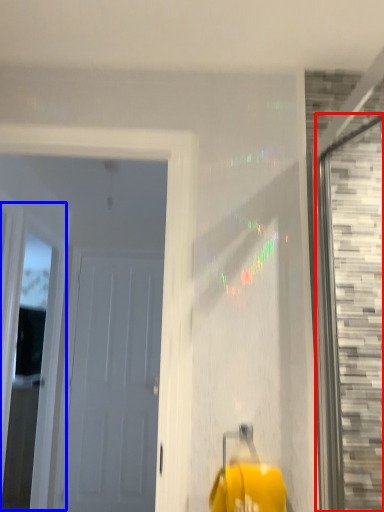
Question: Which object appears closest to the camera in this image, window (highlighted by a red box) or window (highlighted by a blue box)?

Choices:
 (A) window
 (B) window

Answer: (A)